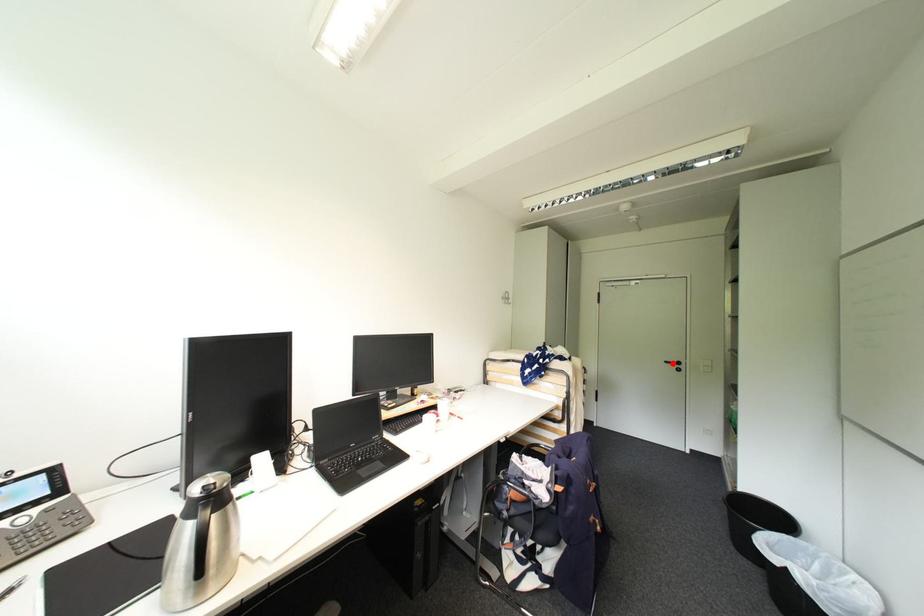
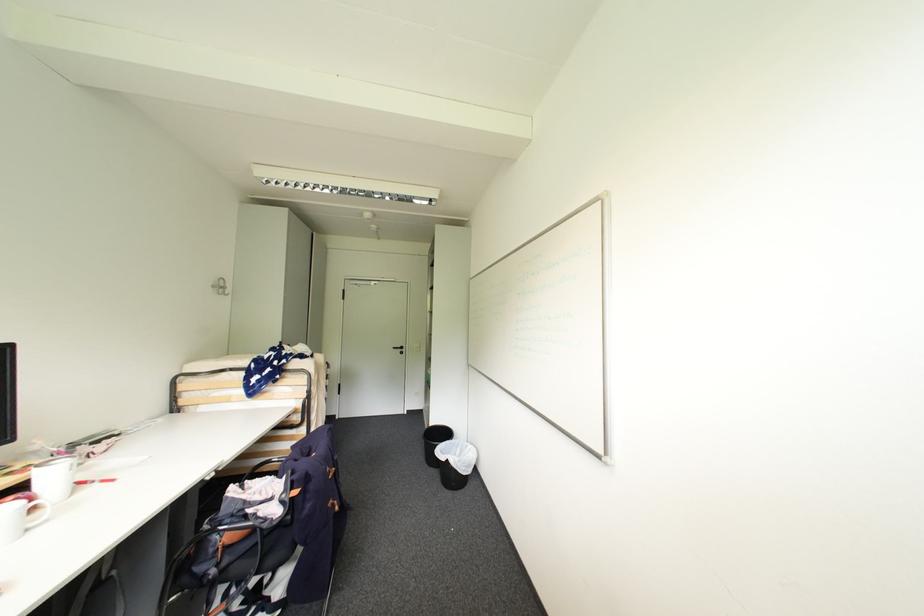
Where in the second image is the point corresponding to the highlighted location from the first image?

(400, 349)